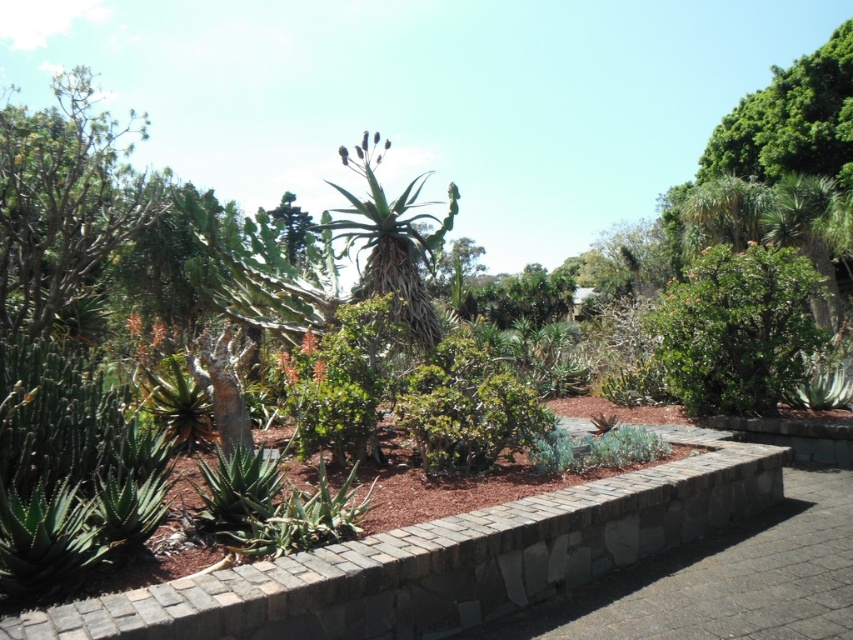
Question: Among these objects, which one is farthest from the camera?

Choices:
 (A) green leafy tree at upper left
 (B) green leafy bush at center-right
 (C) gray stone bench at lower center

Answer: (B)

Question: Estimate the real-world distances between objects in this image. Which object is closer to the green leafy tree at upper left?

Choices:
 (A) gray stone bench at lower center
 (B) green leafy bush at center-right

Answer: (A)

Question: Is green leafy tree at upper left to the right of green leafy bush at center-right from the viewer's perspective?

Choices:
 (A) no
 (B) yes

Answer: (A)

Question: Can you confirm if gray stone bench at lower center is thinner than green leafy bush at center-right?

Choices:
 (A) no
 (B) yes

Answer: (A)

Question: Estimate the real-world distances between objects in this image. Which object is closer to the green leafy bush at center?

Choices:
 (A) green leafy tree at upper left
 (B) gray stone bench at lower center
 (C) green leafy bush at center-right

Answer: (B)

Question: Is gray stone bench at lower center below green leafy bush at center-right?

Choices:
 (A) no
 (B) yes

Answer: (B)